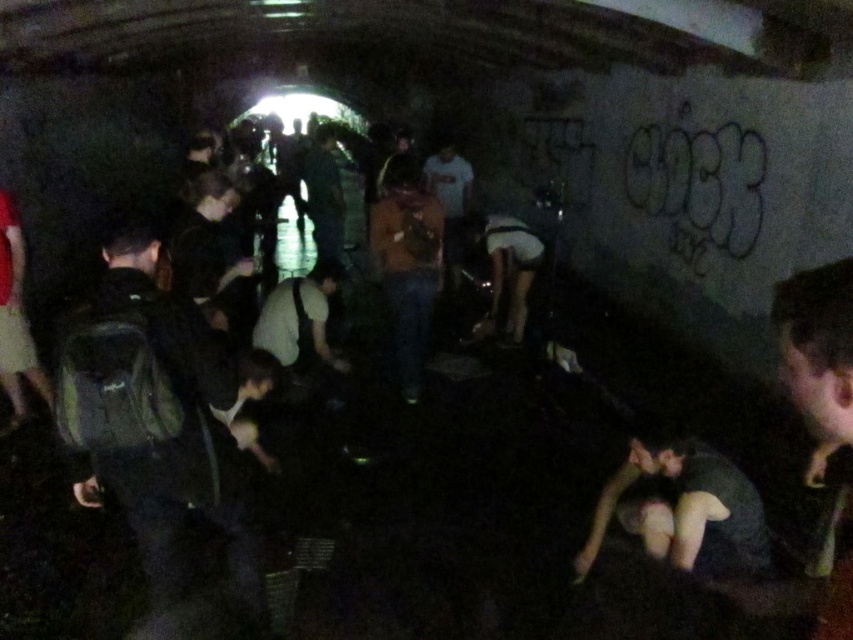
The image size is (853, 640). Find the location of `dark gray fabric at lower right`. dark gray fabric at lower right is located at coordinates (682, 506).

Is dark gray fabric at lower right closer to the viewer compared to white matte shorts at center?

Yes, it is.

Who is more forward, (625,506) or (529,230)?

Positioned in front is point (625,506).

In order to click on dark gray fabric at lower right in this screenshot , I will do coord(682,506).

Can you confirm if dark green backpack at left is taller than dark gray fabric at lower right?

Indeed, dark green backpack at left has a greater height compared to dark gray fabric at lower right.

Can you confirm if dark green backpack at left is thinner than dark gray fabric at lower right?

Correct, dark green backpack at left's width is less than dark gray fabric at lower right's.

Is point (173, 404) positioned behind point (641, 509)?

No.

Locate an element on the screen. The image size is (853, 640). dark green backpack at left is located at coordinates (177, 424).

Who is shorter, dark green backpack at left or dark green shirt at center?

dark green backpack at left is shorter.

Is dark green backpack at left to the left of dark green shirt at center from the viewer's perspective?

No, dark green backpack at left is not to the left of dark green shirt at center.

Which is behind, point (194, 358) or point (308, 192)?

The point (308, 192) is behind.

Find the location of a particular element. The height and width of the screenshot is (640, 853). dark green backpack at left is located at coordinates (177, 424).